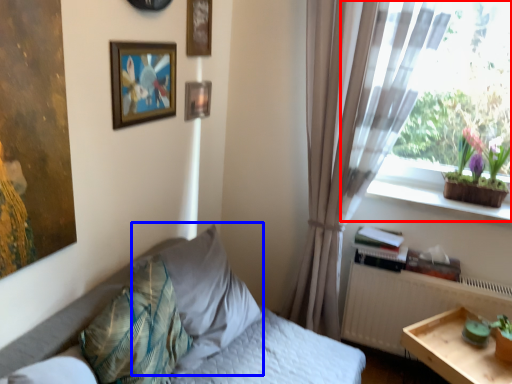
Question: Which point is further to the camera, window (highlighted by a red box) or pillow (highlighted by a blue box)?

Choices:
 (A) window
 (B) pillow

Answer: (A)